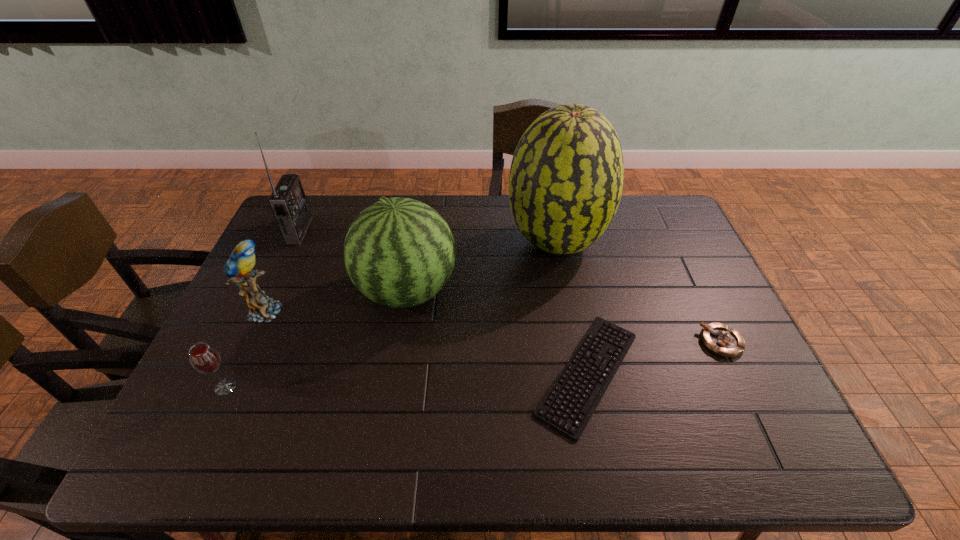
Locate an element on the screen. The height and width of the screenshot is (540, 960). the tallest object is located at coordinates (566, 178).

I want to click on the taller watermelon, so click(566, 178).

Find the location of a particular element. Image resolution: width=960 pixels, height=540 pixels. radio receiver is located at coordinates (288, 202).

Where is `the fourth object from right to left`? This screenshot has height=540, width=960. the fourth object from right to left is located at coordinates (399, 252).

Identify the location of the left watermelon. (399, 252).

At what (x,y) coordinates should I click in order to perform the action: click on parrot. Please return your answer as a coordinate pair (x, y). Looking at the image, I should click on (238, 267).

What are the coordinates of `the third shortest object` in the screenshot? It's located at (204, 358).

In order to click on ashtray in this screenshot , I will do `click(720, 339)`.

The height and width of the screenshot is (540, 960). Identify the location of the rightmost object. (720, 339).

Locate an element on the screen. This screenshot has height=540, width=960. the shortest object is located at coordinates (569, 403).